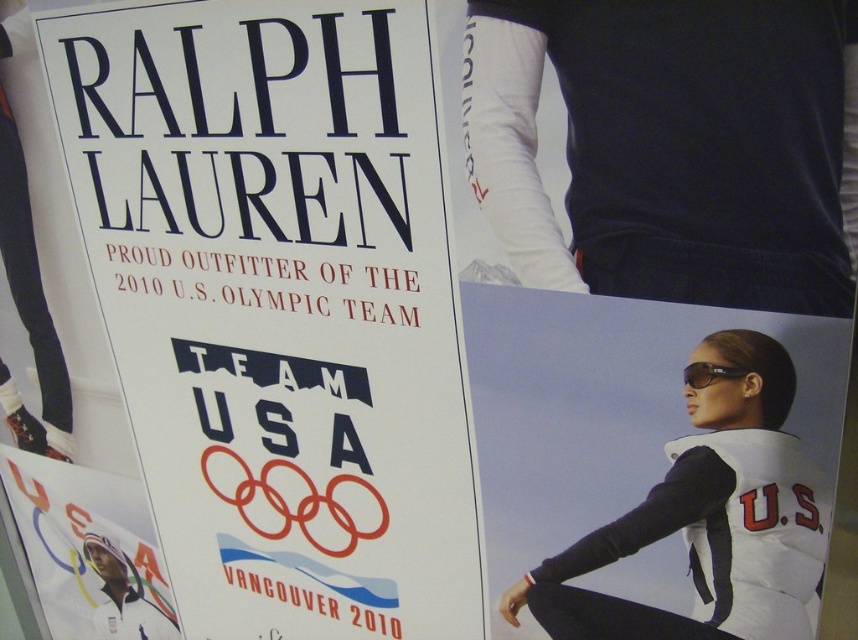
You are designing a layout for a poster and see the white paper at upper left and the white paper at lower left. Which one is taller?

The white paper at upper left is much taller than the white paper at lower left.

You are looking at the promotional poster for Ralph Lauren. There are two points marked on the right side of the poster. The first point is at coordinates point (651, 280) and the second point is at point (713, 364). Which of these two points is closer to you?

Point (651, 280) is further to the camera than point (713, 364), so the point closer to you is point (713, 364).

You are an athlete preparing for the 2010 Winter Olympics. You see the white matte tights at upper center and the matte black goggles at center on the poster. Which piece of equipment should you grab first if you need to adjust something before your event?

You should grab the white matte tights at upper center first because it is closer to you than the matte black goggles at center.